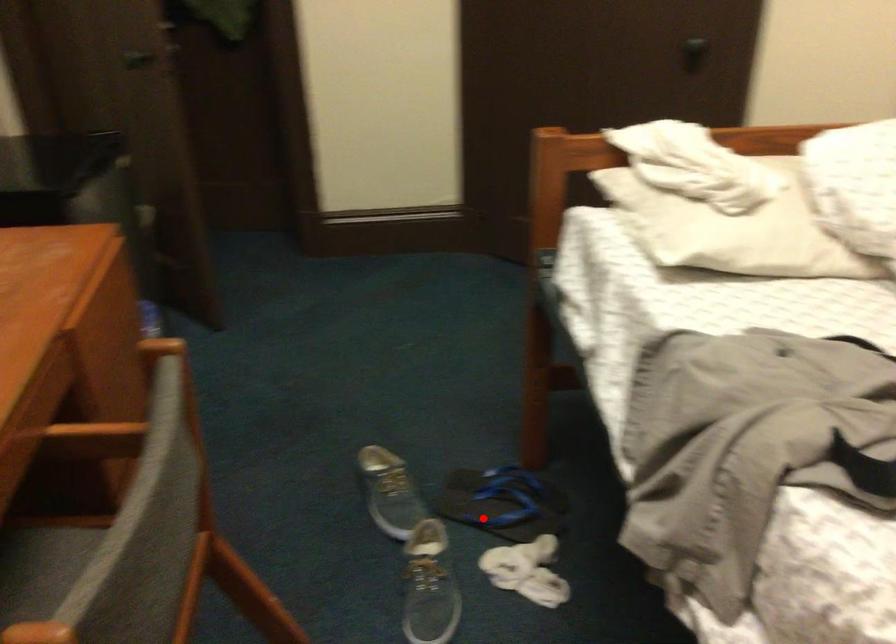
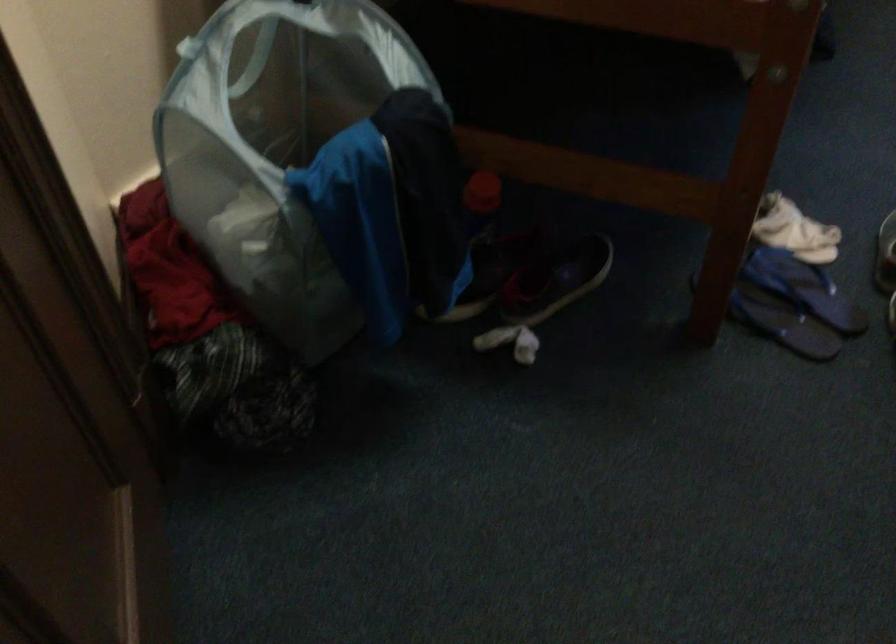
In the second image, find the point that corresponds to the highlighted location in the first image.

(804, 288)